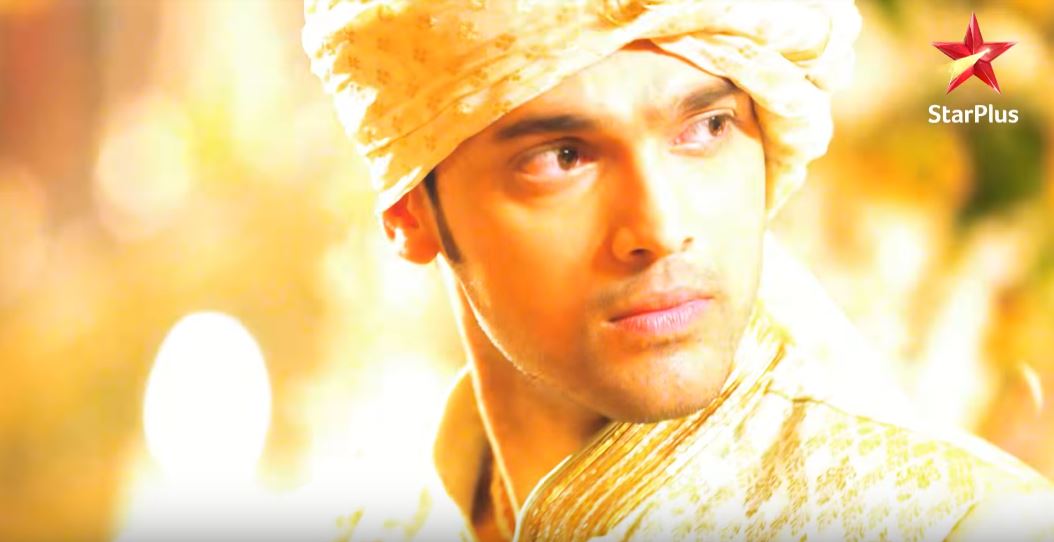
Find the location of `movie poster`. movie poster is located at coordinates pyautogui.click(x=428, y=491).